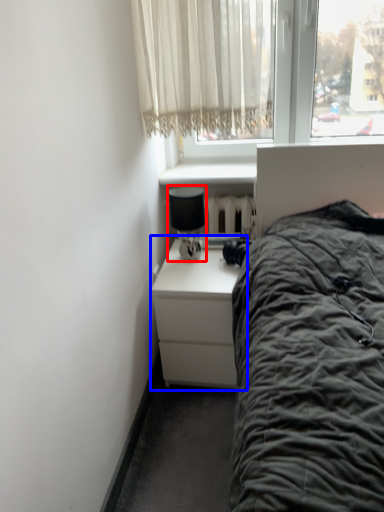
Question: Which object appears farthest to the camera in this image, lamp (highlighted by a red box) or nightstand (highlighted by a blue box)?

Choices:
 (A) lamp
 (B) nightstand

Answer: (A)